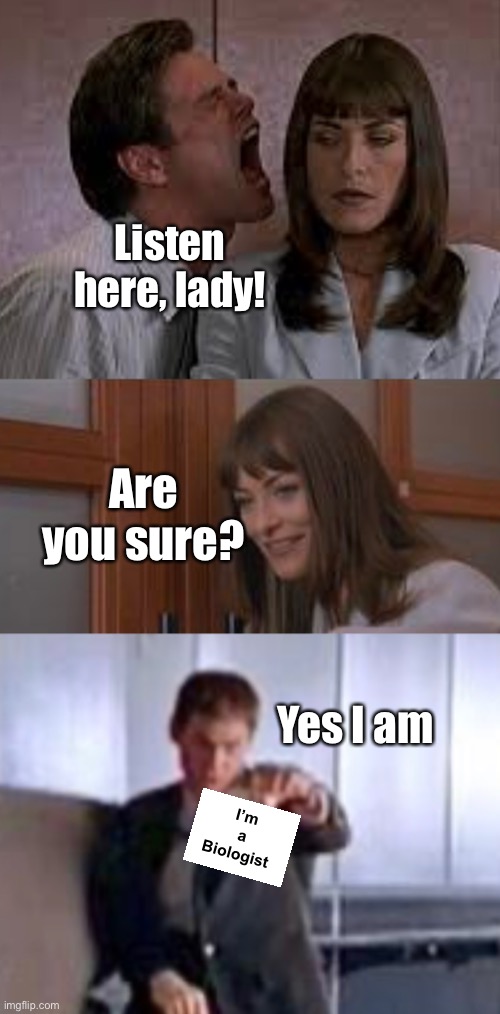
The image size is (500, 1014). I want to click on wall, so click(267, 54).